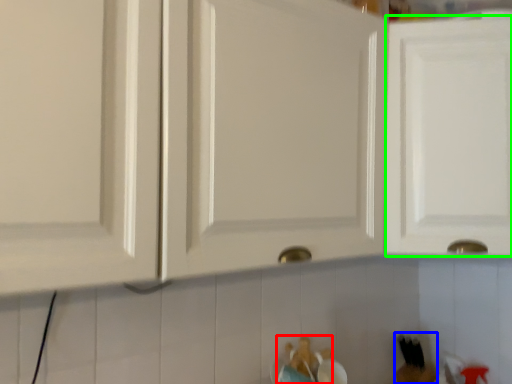
Question: Based on their relative distances, which object is farther from toy (highlighted by a red box)? Choose from toy (highlighted by a blue box) and cabinetry (highlighted by a green box).

Choices:
 (A) toy
 (B) cabinetry

Answer: (B)